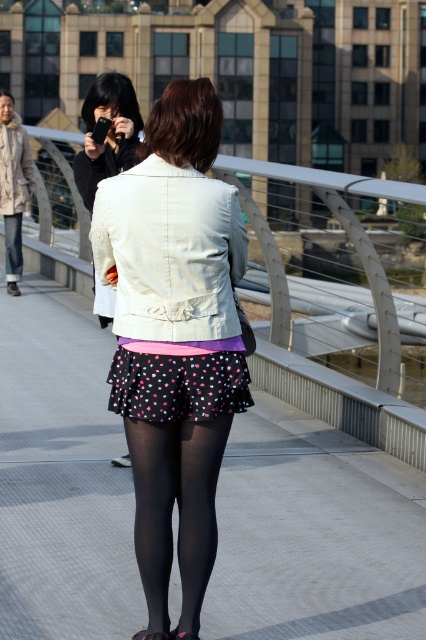
Between black tights at center and white matte jacket at center, which one is positioned lower?

black tights at center is lower down.

Is black tights at center shorter than white matte jacket at center?

No.

You are a GUI agent. You are given a task and a screenshot of the screen. Output one action in this format:
    pyautogui.click(x=<x>, y=<y>)
    Task: Click on the black tights at center
    The height and width of the screenshot is (640, 426).
    Given the screenshot: What is the action you would take?
    pyautogui.click(x=178, y=509)

This screenshot has height=640, width=426. What are the coordinates of `black tights at center` in the screenshot? It's located at (178, 509).

Is point (238, 385) positioned after point (127, 115)?

No, it is not.

Can you confirm if matte white jacket at center is smaller than white matte jacket at center?

Incorrect, matte white jacket at center is not smaller in size than white matte jacket at center.

Who is more distant from viewer, (141, 372) or (111, 168)?

The point (111, 168) is behind.

What are the coordinates of `matte white jacket at center` in the screenshot? It's located at (175, 339).

Is polka dot skirt at center below white matte jacket at center?

Yes.

Does polka dot skirt at center have a greater height compared to white matte jacket at center?

Correct, polka dot skirt at center is much taller as white matte jacket at center.

Between point (140, 321) and point (137, 104), which one is positioned in front?

Point (140, 321)

Where is `polka dot skirt at center`? polka dot skirt at center is located at coordinates [x=172, y=291].